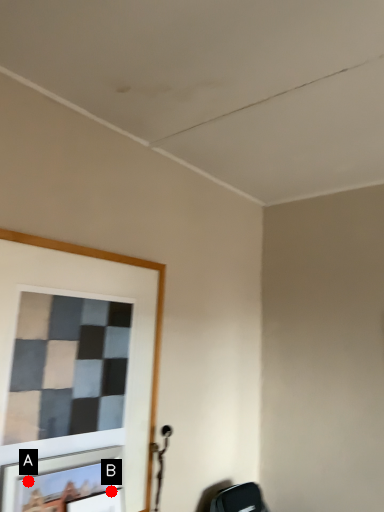
Question: Two points are circled on the image, labeled by A and B beside each circle. Which point is closer to the camera?

Choices:
 (A) A is closer
 (B) B is closer

Answer: (A)